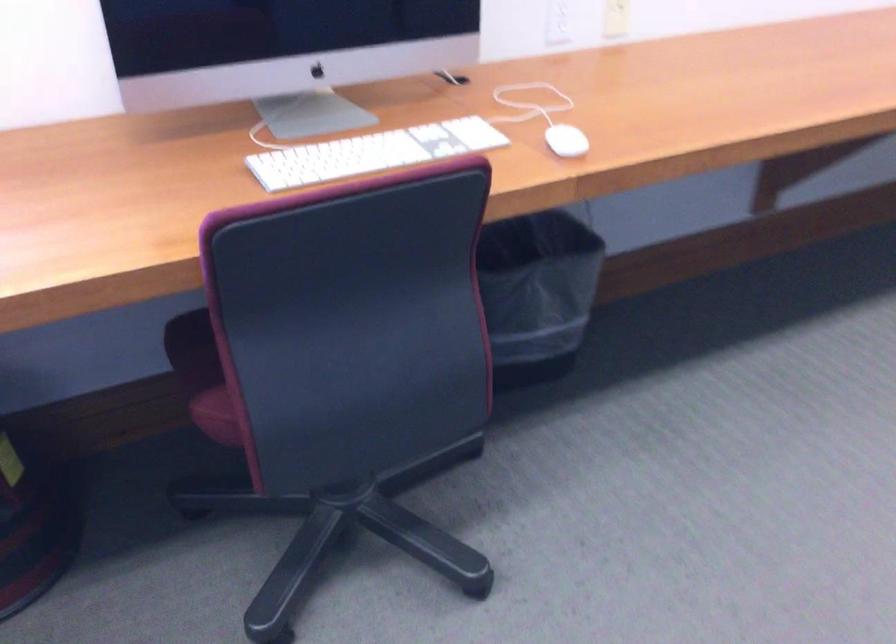
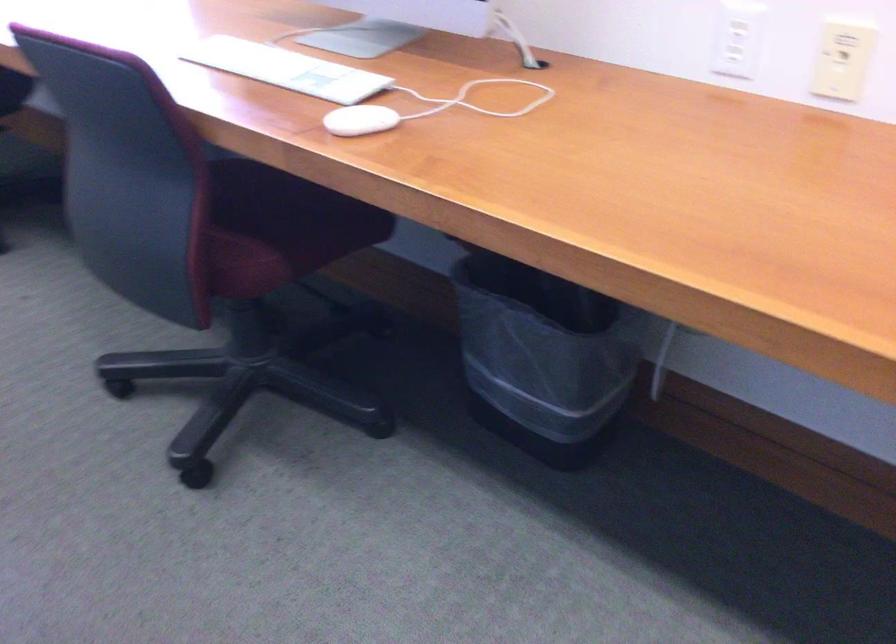
Question: I am providing you with two images of the same scene from different viewpoints. Which of the following objects are not visible in image2?

Choices:
 (A) chair sitting surface
 (B) black trash can
 (C) white electrical outlet
 (D) none of these

Answer: (D)